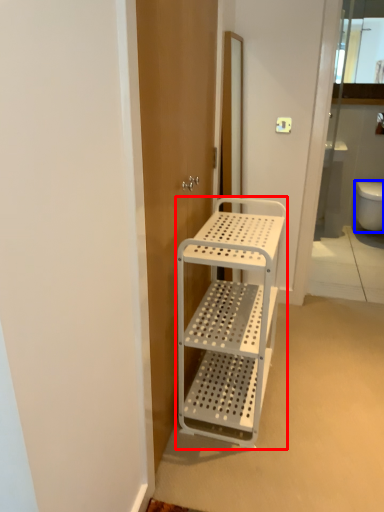
Question: Which object is further to the camera taking this photo, furniture (highlighted by a red box) or toilet bowl (highlighted by a blue box)?

Choices:
 (A) furniture
 (B) toilet bowl

Answer: (B)